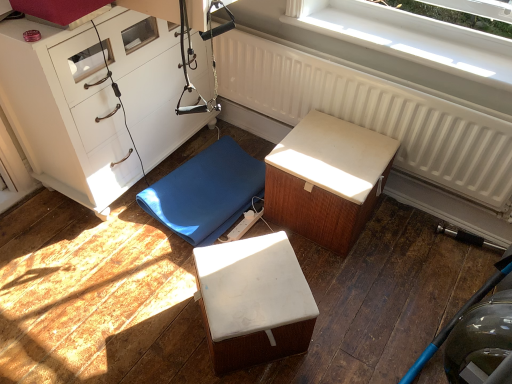
Image resolution: width=512 pixels, height=384 pixels. I want to click on free space above white plastic window at upper center (from a real-world perspective), so click(399, 41).